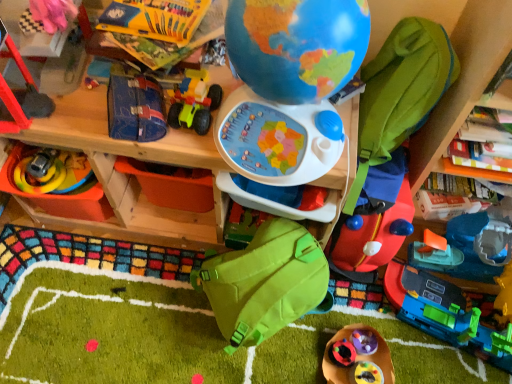
What are the coordinates of `vacant space situated above metallic silver car at lower left, arranged as the eleventh toy when viewed from the right (from a real-world perspective)` in the screenshot? It's located at (47, 167).